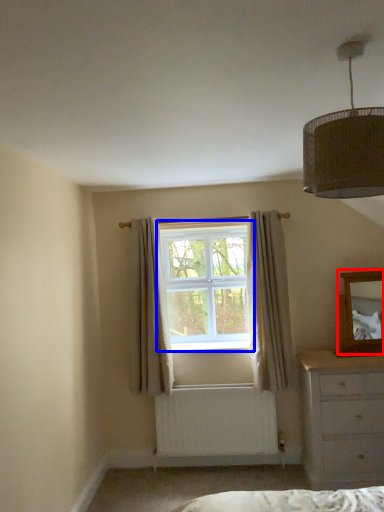
Question: Which of the following is the farthest to the observer, mirror (highlighted by a red box) or window (highlighted by a blue box)?

Choices:
 (A) mirror
 (B) window

Answer: (B)